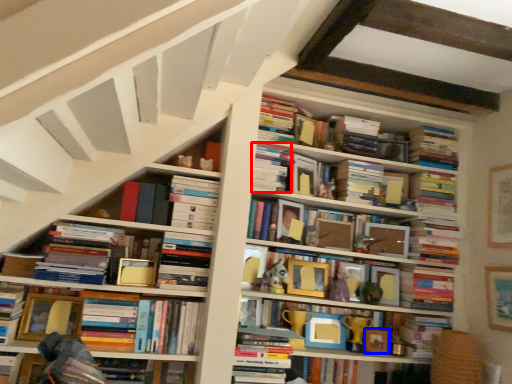
Question: Which object is further to the camera taking this photo, book (highlighted by a red box) or picture frame (highlighted by a blue box)?

Choices:
 (A) book
 (B) picture frame

Answer: (B)